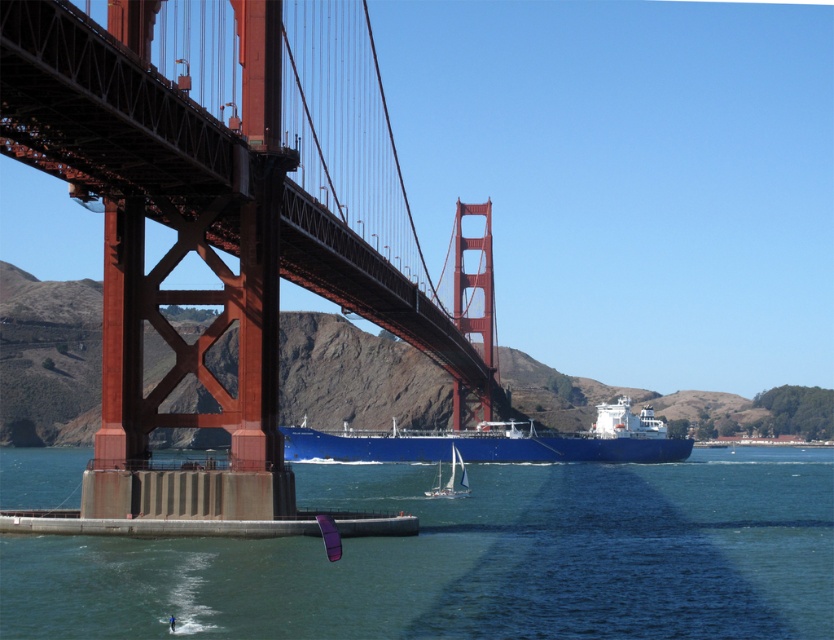
Question: Can you confirm if blue water at lower center is bigger than blue matte ship at center?

Choices:
 (A) no
 (B) yes

Answer: (B)

Question: Estimate the real-world distances between objects in this image. Which object is closer to the blue matte ship at center?

Choices:
 (A) red steel suspension bridge at center
 (B) white sailboat at center

Answer: (B)

Question: Among these points, which one is nearest to the camera?

Choices:
 (A) (139, 221)
 (B) (455, 470)
 (C) (647, 454)

Answer: (A)

Question: Does blue water at lower center appear under red steel suspension bridge at center?

Choices:
 (A) yes
 (B) no

Answer: (A)

Question: Can you confirm if blue water at lower center is positioned above blue matte ship at center?

Choices:
 (A) yes
 (B) no

Answer: (B)

Question: Which point appears farthest from the camera in this image?

Choices:
 (A) (436, 497)
 (B) (488, 477)

Answer: (B)